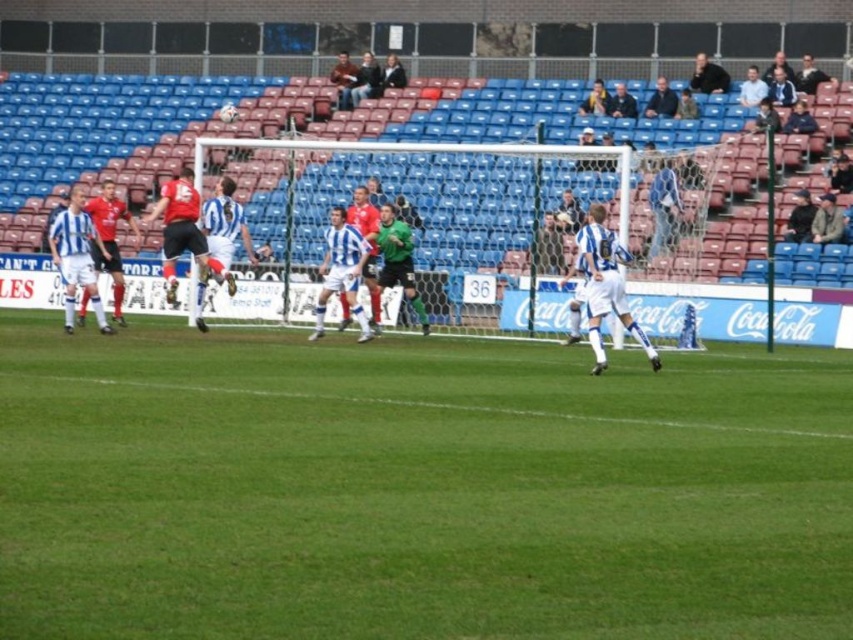
Question: Is green grass at center positioned behind green grass at lower center?

Choices:
 (A) yes
 (B) no

Answer: (B)

Question: Is green grass at lower center above dark blue shirt at upper right?

Choices:
 (A) yes
 (B) no

Answer: (B)

Question: Is green grass at center positioned before dark blue jacket at upper right?

Choices:
 (A) no
 (B) yes

Answer: (B)

Question: Which point appears closest to the camera in this image?

Choices:
 (A) (659, 104)
 (B) (345, 67)
 (C) (720, 90)

Answer: (A)

Question: Considering the real-world distances, which object is farthest from the dark blue shirt at upper center?

Choices:
 (A) green grass at center
 (B) white mesh net at center
 (C) dark blue jersey at center

Answer: (A)

Question: Among these objects, which one is farthest from the camera?

Choices:
 (A) dark blue shirt at upper right
 (B) green jersey at center
 (C) dark blue jersey at upper center

Answer: (B)